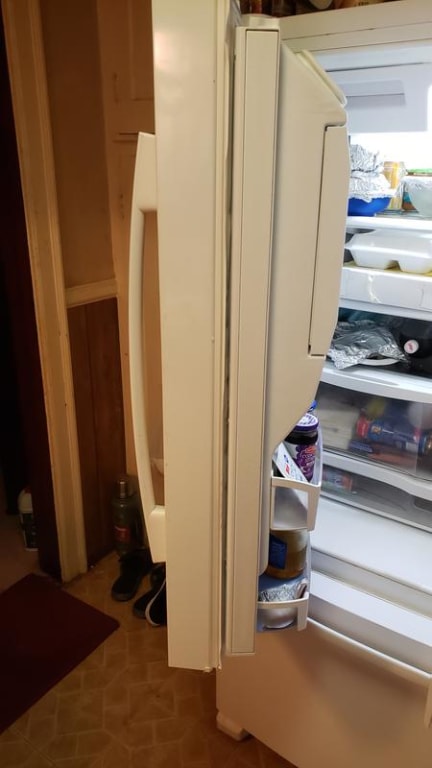
Where is `takeout container in refrigerator`? The height and width of the screenshot is (768, 432). takeout container in refrigerator is located at coordinates (383, 250).